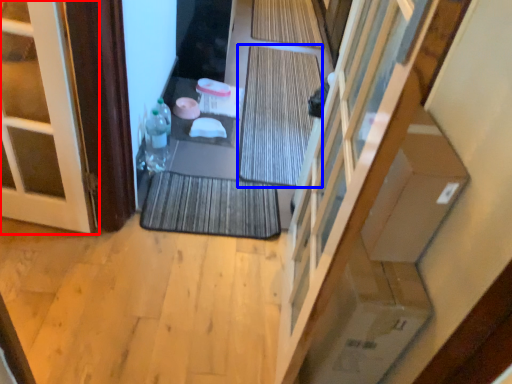
Question: Which object is closer to the camera taking this photo, door (highlighted by a red box) or bath mat (highlighted by a blue box)?

Choices:
 (A) door
 (B) bath mat

Answer: (A)